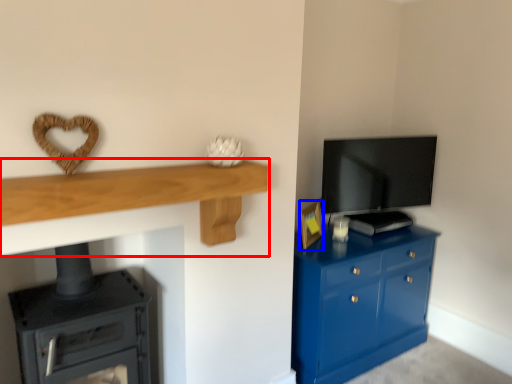
Question: Among these objects, which one is nearest to the camera, shelf (highlighted by a red box) or picture frame (highlighted by a blue box)?

Choices:
 (A) shelf
 (B) picture frame

Answer: (A)